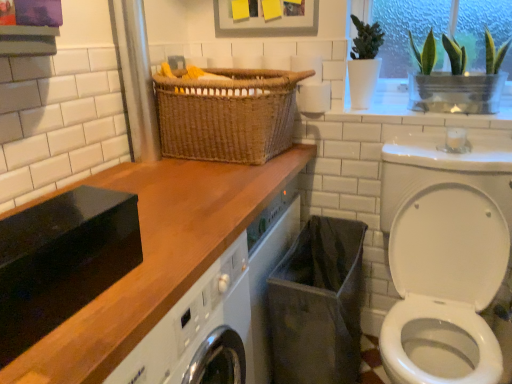
Identify the location of black fabric laundry basket at lower center. Image resolution: width=512 pixels, height=384 pixels. (318, 305).

Image resolution: width=512 pixels, height=384 pixels. What are the coordinates of `wooden at upper left` in the screenshot? It's located at (156, 256).

The image size is (512, 384). In order to click on black fabric laundry basket at lower center in this screenshot , I will do `click(318, 305)`.

Which object is wider, green glass vase at upper right or white matte toilet paper at upper center?

green glass vase at upper right is wider.

Who is shorter, green glass vase at upper right or white matte toilet paper at upper center?

white matte toilet paper at upper center.

Considering the relative sizes of green glass vase at upper right and white matte toilet paper at upper center in the image provided, is green glass vase at upper right bigger than white matte toilet paper at upper center?

Correct, green glass vase at upper right is larger in size than white matte toilet paper at upper center.

Image resolution: width=512 pixels, height=384 pixels. What are the coordinates of `toilet paper beneath the green glass vase at upper right (from a real-world perspective)` in the screenshot? It's located at (313, 97).

Does woven brown basket at center have a lesser height compared to white glossy washer at lower right?

Correct, woven brown basket at center is not as tall as white glossy washer at lower right.

Which object is closer to the camera taking this photo, woven brown basket at center or white glossy washer at lower right?

white glossy washer at lower right.

From the image's perspective, is woven brown basket at center located above white glossy washer at lower right?

Indeed, from the image's perspective, woven brown basket at center is shown above white glossy washer at lower right.

Is woven brown basket at center bigger than white glossy washer at lower right?

No.

Can you tell me how much black fabric laundry basket at lower center and white matte toilet paper at upper center differ in facing direction?

black fabric laundry basket at lower center and white matte toilet paper at upper center are facing 1.02 degrees away from each other.

Which of these two, black fabric laundry basket at lower center or white matte toilet paper at upper center, is wider?

With larger width is black fabric laundry basket at lower center.

Which object is positioned more to the left, black fabric laundry basket at lower center or white matte toilet paper at upper center?

Positioned to the left is white matte toilet paper at upper center.

Which is nearer, (312, 254) or (302, 84)?

Point (312, 254).

Does white glossy washer at lower right turn towards wooden at upper left?

No, white glossy washer at lower right is not oriented towards wooden at upper left.

Is white glossy washer at lower right smaller than wooden at upper left?

No.

In the image, is white glossy washer at lower right positioned in front of or behind wooden at upper left?

In the image, white glossy washer at lower right appears behind wooden at upper left.

Between black fabric laundry basket at lower center and white glossy washer at lower right, which one has smaller size?

Smaller between the two is black fabric laundry basket at lower center.

From the image's perspective, which one is positioned higher, black fabric laundry basket at lower center or white glossy washer at lower right?

From the image's view, white glossy washer at lower right is above.

Which object is thinner, black fabric laundry basket at lower center or white glossy washer at lower right?

With smaller width is black fabric laundry basket at lower center.

This screenshot has width=512, height=384. I want to click on laundry basket below the white glossy washer at lower right (from a real-world perspective), so click(x=318, y=305).

Does green glass vase at upper right have a greater height compared to black fabric laundry basket at lower center?

No, green glass vase at upper right is not taller than black fabric laundry basket at lower center.

Which object is closer to the camera taking this photo, green glass vase at upper right or black fabric laundry basket at lower center?

black fabric laundry basket at lower center is closer to the camera.

Which is closer to the camera, (435, 59) or (285, 381)?

The point (285, 381) is more forward.

Would you say green glass vase at upper right contains black fabric laundry basket at lower center?

No.

Can you see woven brown basket at center touching black fabric laundry basket at lower center?

No, woven brown basket at center is not beside black fabric laundry basket at lower center.

From a real-world perspective, is woven brown basket at center on black fabric laundry basket at lower center?

Yes.

How many degrees apart are the facing directions of woven brown basket at center and black fabric laundry basket at lower center?

1.02 degrees separate the facing orientations of woven brown basket at center and black fabric laundry basket at lower center.

Locate an element on the screen. Image resolution: width=512 pixels, height=384 pixels. basket on the left side of black fabric laundry basket at lower center is located at coordinates (227, 115).

In the image, there is a white matte toilet paper at upper center. Where is `plant above it (from the image's perspective)`? Image resolution: width=512 pixels, height=384 pixels. plant above it (from the image's perspective) is located at coordinates (425, 53).

Identify the location of washer below the woven brown basket at center (from a real-world perspective). (444, 258).

From the image, which object appears to be farther from green glass vase at upper right, wooden at upper left or white glossy washer at lower right?

Based on the image, wooden at upper left appears to be further to green glass vase at upper right.

Estimate the real-world distances between objects in this image. Which object is further from woven brown basket at center, white matte toilet paper at upper center or wooden at upper left?

The object further to woven brown basket at center is white matte toilet paper at upper center.

Which object lies nearer to the anchor point white glossy washer at lower right, woven brown basket at center or white matte toilet paper at upper center?

The object closer to white glossy washer at lower right is woven brown basket at center.

Estimate the real-world distances between objects in this image. Which object is further from green glass vase at upper right, black fabric laundry basket at lower center or white glossy washer at lower right?

black fabric laundry basket at lower center is further to green glass vase at upper right.

Consider the image. From the image, which object appears to be nearer to woven brown basket at center, black fabric laundry basket at lower center or green glass vase at upper right?

black fabric laundry basket at lower center is positioned closer to the anchor woven brown basket at center.

When comparing their distances from woven brown basket at center, does white glossy washer at lower right or wooden at upper left seem further?

white glossy washer at lower right is positioned further to the anchor woven brown basket at center.

Estimate the real-world distances between objects in this image. Which object is further from green glass vase at upper right, black fabric laundry basket at lower center or wooden at upper left?

wooden at upper left lies further to green glass vase at upper right than the other object.

Considering their positions, is white glossy washer at lower right positioned closer to wooden at upper left than woven brown basket at center?

The object closer to wooden at upper left is woven brown basket at center.

Find the location of a particular element. This screenshot has height=384, width=512. washer between woven brown basket at center and black fabric laundry basket at lower center vertically is located at coordinates (444, 258).

At what (x,y) coordinates should I click in order to perform the action: click on toilet paper between green glass vase at upper right and white glossy washer at lower right from top to bottom. Please return your answer as a coordinate pair (x, y). This screenshot has width=512, height=384. Looking at the image, I should click on (313, 97).

Image resolution: width=512 pixels, height=384 pixels. Identify the location of washer located between wooden at upper left and green glass vase at upper right in the left-right direction. (444, 258).

The width and height of the screenshot is (512, 384). Find the location of `basket between wooden at upper left and green glass vase at upper right`. basket between wooden at upper left and green glass vase at upper right is located at coordinates pyautogui.click(x=227, y=115).